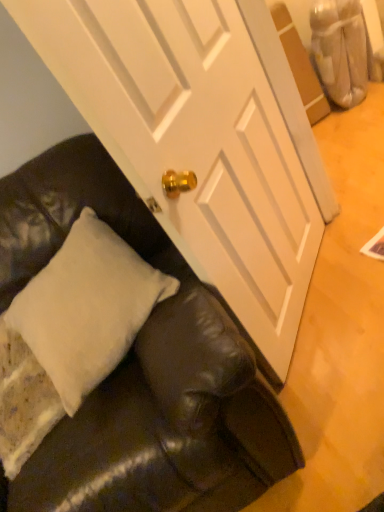
Question: From a real-world perspective, is black leather couch at lower left physically above white soft pillow at lower left?

Choices:
 (A) yes
 (B) no

Answer: (B)

Question: From a real-world perspective, is black leather couch at lower left located beneath white soft pillow at lower left?

Choices:
 (A) yes
 (B) no

Answer: (A)

Question: Is black leather couch at lower left far from white soft pillow at lower left?

Choices:
 (A) no
 (B) yes

Answer: (A)

Question: Does black leather couch at lower left lie in front of white soft pillow at lower left?

Choices:
 (A) yes
 (B) no

Answer: (A)

Question: Could you tell me if black leather couch at lower left is turned towards white soft pillow at lower left?

Choices:
 (A) yes
 (B) no

Answer: (A)

Question: Is white soft pillow at lower left inside black leather couch at lower left?

Choices:
 (A) yes
 (B) no

Answer: (A)

Question: Does white soft pillow at lower left appear on the left side of black leather couch at lower left?

Choices:
 (A) no
 (B) yes

Answer: (B)

Question: Considering the relative sizes of white soft pillow at lower left and black leather couch at lower left in the image provided, is white soft pillow at lower left taller than black leather couch at lower left?

Choices:
 (A) yes
 (B) no

Answer: (B)

Question: Considering the relative sizes of white soft pillow at lower left and black leather couch at lower left in the image provided, is white soft pillow at lower left shorter than black leather couch at lower left?

Choices:
 (A) no
 (B) yes

Answer: (B)

Question: Considering the relative sizes of white soft pillow at lower left and black leather couch at lower left in the image provided, is white soft pillow at lower left wider than black leather couch at lower left?

Choices:
 (A) no
 (B) yes

Answer: (A)

Question: From the image's perspective, would you say white soft pillow at lower left is shown under black leather couch at lower left?

Choices:
 (A) no
 (B) yes

Answer: (A)

Question: Is white soft pillow at lower left turned away from black leather couch at lower left?

Choices:
 (A) yes
 (B) no

Answer: (A)

Question: Is point (288, 451) closer or farther from the camera than point (97, 244)?

Choices:
 (A) closer
 (B) farther

Answer: (A)